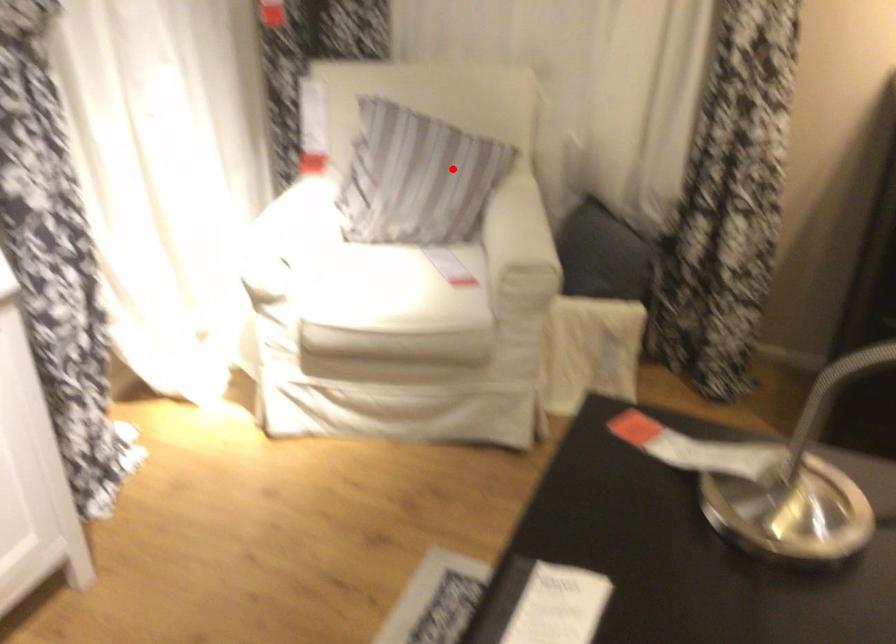
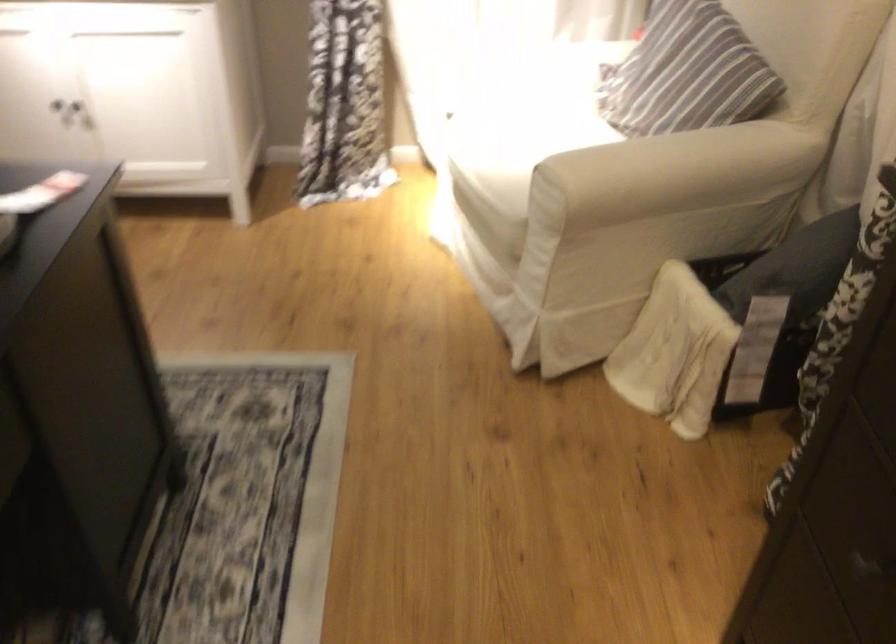
Where in the second image is the point corresponding to the highlighted location from the first image?

(687, 73)